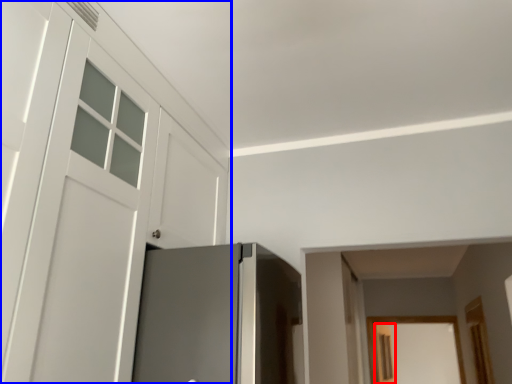
Question: Which object appears closest to the camera in this image, screen door (highlighted by a red box) or door (highlighted by a blue box)?

Choices:
 (A) screen door
 (B) door

Answer: (B)